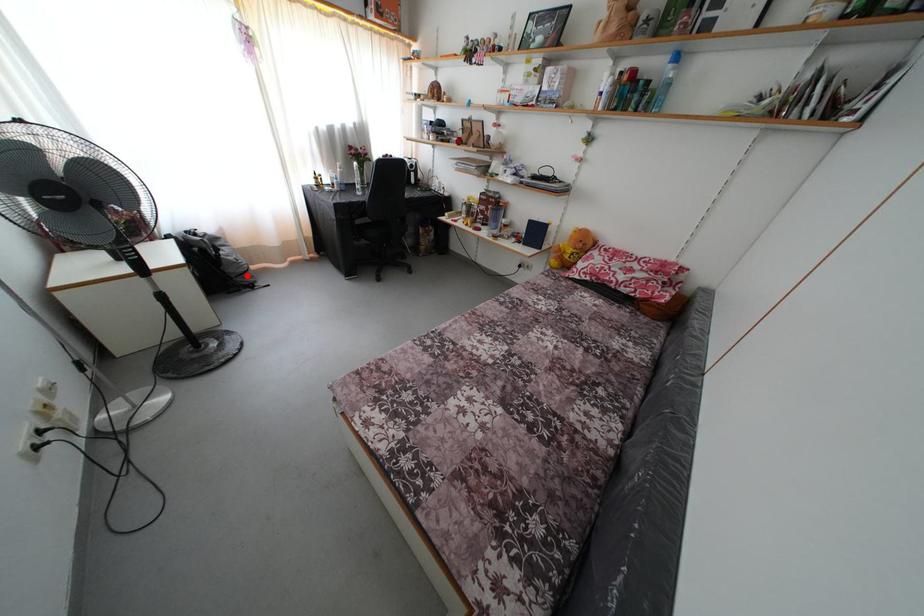
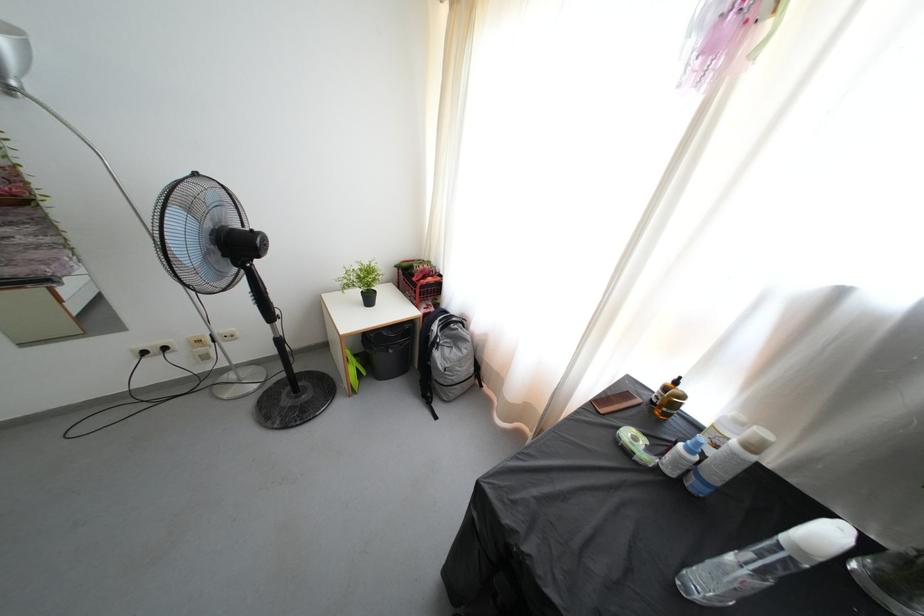
Question: I am providing you with two images of the same scene from different viewpoints. Given a red point in image1, look at the same physical point in image2. Is it:

Choices:
 (A) Closer to the viewpoint
 (B) Farther from the viewpoint

Answer: (B)